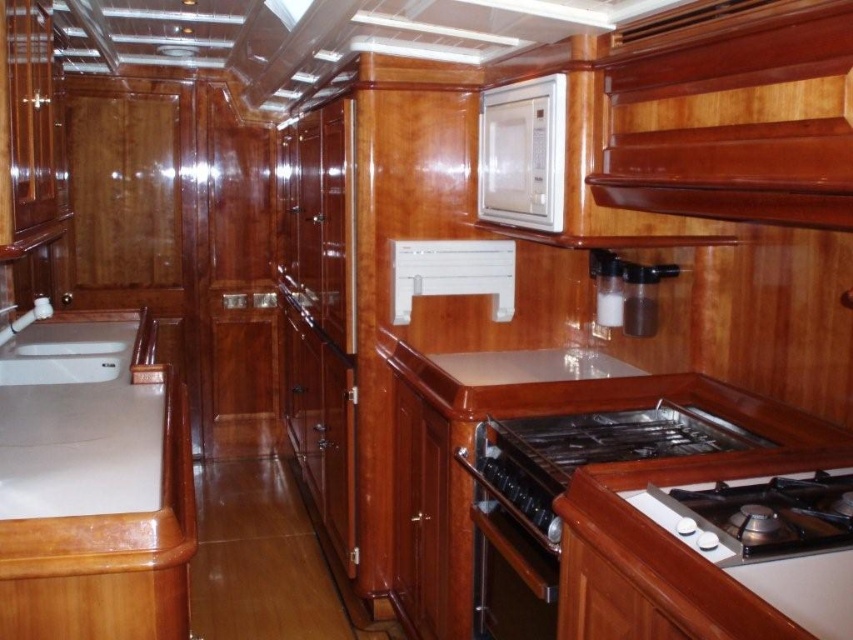
You are a chef preparing to cook in this yacht kitchen. You notice a specific point at coordinates point (587, 452). Which appliance is this point located on?

The point (587, 452) is located on the black polished metal gas stove at lower right.

You are standing in the yacht kitchen and want to reach the point marked at coordinates (589, 426). If your arm can extend 1.8 meters, can you comfortably reach that point without moving your feet?

The distance between you and the point marked at coordinates (589, 426) is 1.96 meters. Since your arm can only extend 1.8 meters, you cannot comfortably reach that point without moving your feet.